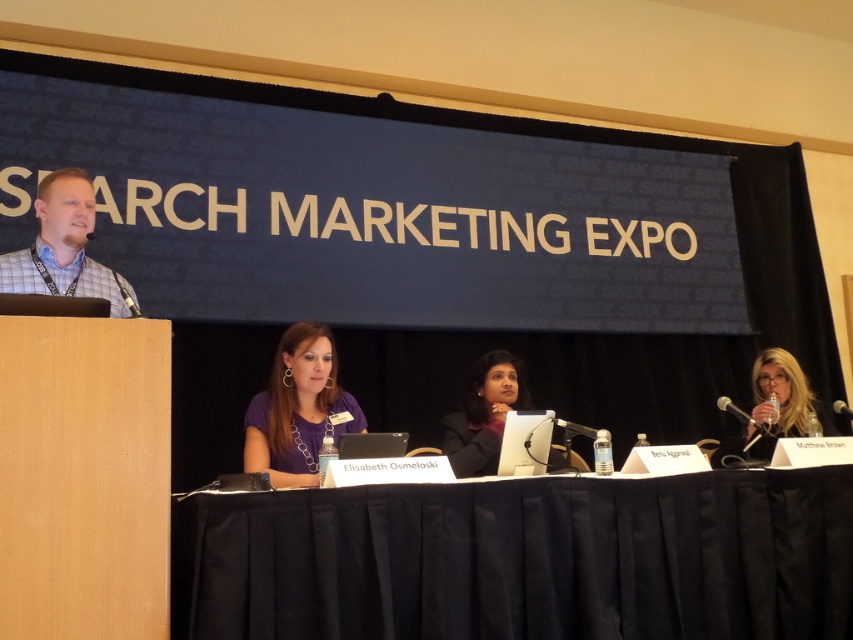
Question: Is black fabric table at lower center further to the viewer compared to plaid shirt at left?

Choices:
 (A) no
 (B) yes

Answer: (A)

Question: Is black fabric table at lower center positioned before plaid shirt at left?

Choices:
 (A) no
 (B) yes

Answer: (B)

Question: Does purple fabric shirt at center have a lesser width compared to plaid shirt at left?

Choices:
 (A) no
 (B) yes

Answer: (B)

Question: Which point appears farthest from the camera in this image?

Choices:
 (A) (474, 468)
 (B) (779, 406)
 (C) (326, 410)

Answer: (B)

Question: Among these points, which one is nearest to the camera?

Choices:
 (A) [112, 301]
 (B) [833, 403]
 (C) [236, 561]
 (D) [556, 449]

Answer: (C)

Question: Which point is closer to the camera taking this photo?

Choices:
 (A) (107, 291)
 (B) (282, 461)
 (C) (833, 401)

Answer: (A)